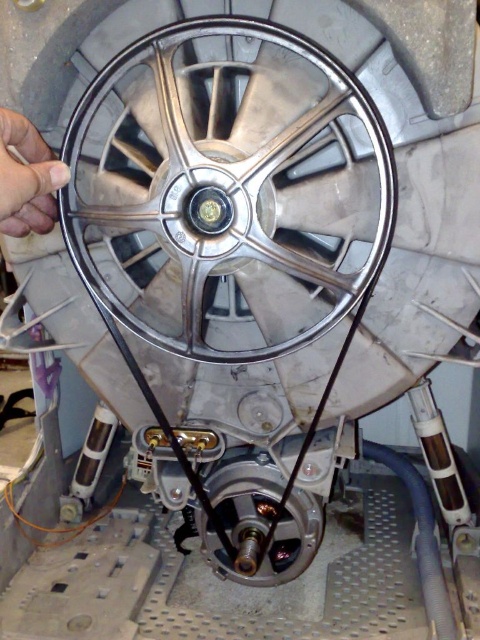
Does metallic silver gear at center have a lesser height compared to silver metallic rim at center?

In fact, metallic silver gear at center may be taller than silver metallic rim at center.

Where is `metallic silver gear at center`? The height and width of the screenshot is (640, 480). metallic silver gear at center is located at coordinates (260, 524).

The width and height of the screenshot is (480, 640). Find the location of `metallic silver gear at center`. metallic silver gear at center is located at coordinates (260, 524).

Is polished silver rim at center behind metallic silver gear at center?

No, it is not.

Does polished silver rim at center have a greater width compared to metallic silver gear at center?

Indeed, polished silver rim at center has a greater width compared to metallic silver gear at center.

The image size is (480, 640). In order to click on polished silver rim at center in this screenshot , I will do `click(217, 180)`.

Is polished silver rim at center bigger than silver metallic rim at center?

Yes, polished silver rim at center is bigger than silver metallic rim at center.

Can you confirm if polished silver rim at center is wider than silver metallic rim at center?

Yes.

Locate an element on the screen. polished silver rim at center is located at coordinates (217, 180).